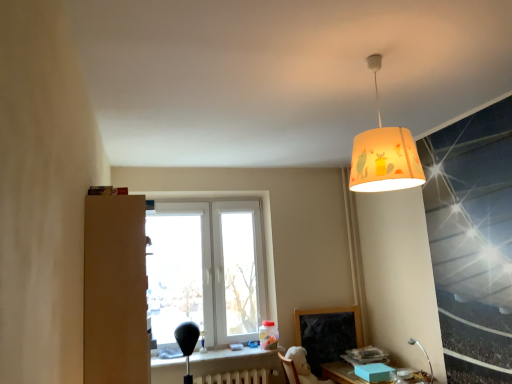
Describe the element at coordinates (384, 154) in the screenshot. Image resolution: width=512 pixels, height=384 pixels. I see `matte yellow lampshade at upper center` at that location.

The image size is (512, 384). What do you see at coordinates (341, 373) in the screenshot? I see `matte wooden table at lower right, which is counted as the second table, starting from the left` at bounding box center [341, 373].

Describe the element at coordinates (236, 377) in the screenshot. This screenshot has width=512, height=384. I see `white painted metal radiator at lower center` at that location.

This screenshot has height=384, width=512. What do you see at coordinates (425, 355) in the screenshot? I see `flexible metal table lamp at lower right` at bounding box center [425, 355].

Measure the distance between white plastic window at center and camera.

white plastic window at center and camera are 3.62 meters apart from each other.

The height and width of the screenshot is (384, 512). Describe the element at coordinates (207, 269) in the screenshot. I see `white plastic window at center` at that location.

What do you see at coordinates (238, 362) in the screenshot? I see `matte black table at lower center, the 1th table viewed from the left` at bounding box center [238, 362].

This screenshot has width=512, height=384. What do you see at coordinates (300, 366) in the screenshot?
I see `white plush swivel chair at lower center` at bounding box center [300, 366].

At what (x,y) coordinates should I click in order to perform the action: click on matte yellow lampshade at upper center. Please return your answer as a coordinate pair (x, y). The image size is (512, 384). Looking at the image, I should click on (384, 154).

In the scene shown: Which point is more forward, (x=210, y=376) or (x=305, y=379)?

The point (x=305, y=379) is in front.

Considering the positions of objects white painted metal radiator at lower center and white plush swivel chair at lower center in the image provided, who is more to the right, white painted metal radiator at lower center or white plush swivel chair at lower center?

From the viewer's perspective, white plush swivel chair at lower center appears more on the right side.

From the image's perspective, relative to white plush swivel chair at lower center, is white painted metal radiator at lower center above or below?

Clearly, from the image's perspective, white painted metal radiator at lower center is below white plush swivel chair at lower center.

Could you tell me if white plastic window at center is facing matte yellow lampshade at upper center?

Yes, white plastic window at center is oriented towards matte yellow lampshade at upper center.

Is white plastic window at center wider or thinner than matte yellow lampshade at upper center?

In the image, white plastic window at center appears to be more narrow than matte yellow lampshade at upper center.

Would you say matte yellow lampshade at upper center is part of white plastic window at center's contents?

Definitely not — matte yellow lampshade at upper center is not inside white plastic window at center.

Considering the sizes of objects white plastic window at center and matte yellow lampshade at upper center in the image provided, who is smaller, white plastic window at center or matte yellow lampshade at upper center?

matte yellow lampshade at upper center.

Which of these two, matte yellow lampshade at upper center or matte black table at lower center, which ranks as the second table in right-to-left order, is bigger?

With larger size is matte yellow lampshade at upper center.

Is matte yellow lampshade at upper center far from matte black table at lower center, the 1th table viewed from the left?

matte yellow lampshade at upper center is positioned a significant distance from matte black table at lower center, the 1th table viewed from the left.

From the picture: Does matte yellow lampshade at upper center come in front of matte black table at lower center, which ranks as the second table in right-to-left order?

Yes, it is.

Based on the photo, which point is more forward, (x=369, y=149) or (x=210, y=367)?

Point (x=369, y=149)

Looking at this image, is white plastic window at center not within flexible metal table lamp at lower right?

white plastic window at center is positioned outside flexible metal table lamp at lower right.

Is point (156, 254) farther from viewer compared to point (430, 369)?

Yes.

Can you tell me how much white plastic window at center and flexible metal table lamp at lower right differ in facing direction?

They differ by 90 degrees in their facing directions.

Who is more distant, white plastic window at center or flexible metal table lamp at lower right?

white plastic window at center is further from the camera.

From a real-world perspective, between flexible metal table lamp at lower right and white plastic window at center, who is vertically higher?

white plastic window at center, from a real-world perspective.

Is point (433, 378) positioned after point (240, 296)?

That is False.

Is flexible metal table lamp at lower right placed right next to white plastic window at center?

flexible metal table lamp at lower right and white plastic window at center are clearly separated.

Considering their positions, is flexible metal table lamp at lower right located in front of or behind white plastic window at center?

flexible metal table lamp at lower right is positioned closer to the viewer than white plastic window at center.

Looking at their sizes, would you say matte yellow lampshade at upper center is wider or thinner than flexible metal table lamp at lower right?

In the image, matte yellow lampshade at upper center appears to be wider than flexible metal table lamp at lower right.

Can you confirm if matte yellow lampshade at upper center is positioned to the left of flexible metal table lamp at lower right?

Yes, matte yellow lampshade at upper center is to the left of flexible metal table lamp at lower right.

From a real-world perspective, relative to flexible metal table lamp at lower right, is matte yellow lampshade at upper center vertically above or below?

Clearly, from a real-world perspective, matte yellow lampshade at upper center is above flexible metal table lamp at lower right.

How many degrees apart are the facing directions of matte yellow lampshade at upper center and flexible metal table lamp at lower right?

The facing directions of matte yellow lampshade at upper center and flexible metal table lamp at lower right are 0.00186 degrees apart.

Who is more distant, white plastic window at center or white painted metal radiator at lower center?

white plastic window at center is behind.

Is white plastic window at center oriented towards white painted metal radiator at lower center?

No, white plastic window at center is not turned towards white painted metal radiator at lower center.

Is point (149, 314) more distant than point (217, 382)?

No, it is in front of (217, 382).

Identify the location of swivel chair above the white painted metal radiator at lower center (from the image's perspective). coord(300,366).

Image resolution: width=512 pixels, height=384 pixels. I want to click on window on the left of matte yellow lampshade at upper center, so click(207, 269).

From the image, which object appears to be nearer to flexible metal table lamp at lower right, matte black table at lower center, the 1th table viewed from the left, or white plush swivel chair at lower center?

white plush swivel chair at lower center.

When comparing their distances from matte yellow lampshade at upper center, does matte wooden table at lower right, acting as the first table starting from the right, or white plastic window at center seem closer?

Among the two, matte wooden table at lower right, acting as the first table starting from the right, is located nearer to matte yellow lampshade at upper center.

From the image, which object appears to be nearer to matte yellow lampshade at upper center, flexible metal table lamp at lower right or white painted metal radiator at lower center?

flexible metal table lamp at lower right is positioned closer to the anchor matte yellow lampshade at upper center.

From the image, which object appears to be nearer to white painted metal radiator at lower center, matte yellow lampshade at upper center or matte black table at lower center, which ranks as the second table in right-to-left order?

matte black table at lower center, which ranks as the second table in right-to-left order, is positioned closer to the anchor white painted metal radiator at lower center.

When comparing their distances from white plush swivel chair at lower center, does matte wooden table at lower right, acting as the first table starting from the right, or flexible metal table lamp at lower right seem further?

flexible metal table lamp at lower right.

Estimate the real-world distances between objects in this image. Which object is further from white painted metal radiator at lower center, flexible metal table lamp at lower right or matte black table at lower center, the 1th table viewed from the left?

Among the two, flexible metal table lamp at lower right is located further to white painted metal radiator at lower center.

Looking at the image, which one is located further to matte wooden table at lower right, acting as the first table starting from the right, white plush swivel chair at lower center or white painted metal radiator at lower center?

white painted metal radiator at lower center.

Based on their spatial positions, is white plastic window at center or matte yellow lampshade at upper center closer to matte black table at lower center, which ranks as the second table in right-to-left order?

white plastic window at center is positioned closer to the anchor matte black table at lower center, which ranks as the second table in right-to-left order.

Identify the location of table between white plastic window at center and matte wooden table at lower right, which is counted as the second table, starting from the left, in the horizontal direction. Image resolution: width=512 pixels, height=384 pixels. (238, 362).

This screenshot has height=384, width=512. In order to click on swivel chair situated between matte black table at lower center, the 1th table viewed from the left, and matte wooden table at lower right, acting as the first table starting from the right, from left to right in this screenshot , I will do `click(300, 366)`.

Identify the location of swivel chair between white plastic window at center and matte wooden table at lower right, which is counted as the second table, starting from the left, in the horizontal direction. The width and height of the screenshot is (512, 384). (300, 366).

Find the location of a particular element. table lamp between matte yellow lampshade at upper center and white painted metal radiator at lower center vertically is located at coordinates (425, 355).